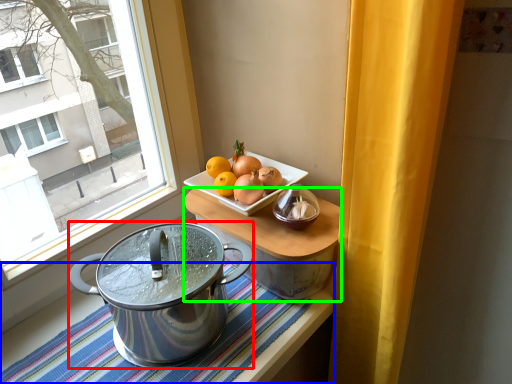
Question: Which object is the closest to the kitchen appliance (highlighted by a red box)? Choose among these: tablecloth (highlighted by a blue box) or table (highlighted by a green box).

Choices:
 (A) tablecloth
 (B) table

Answer: (B)